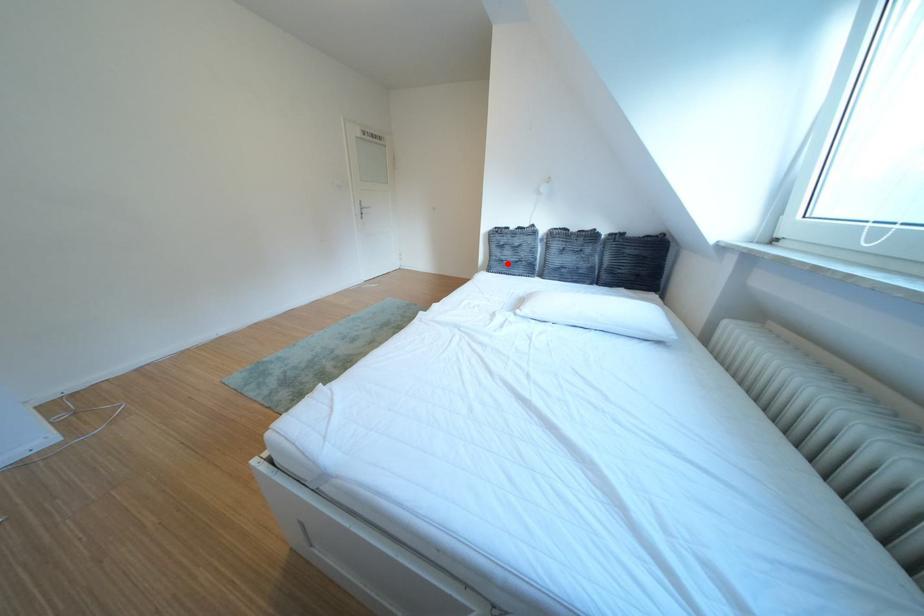
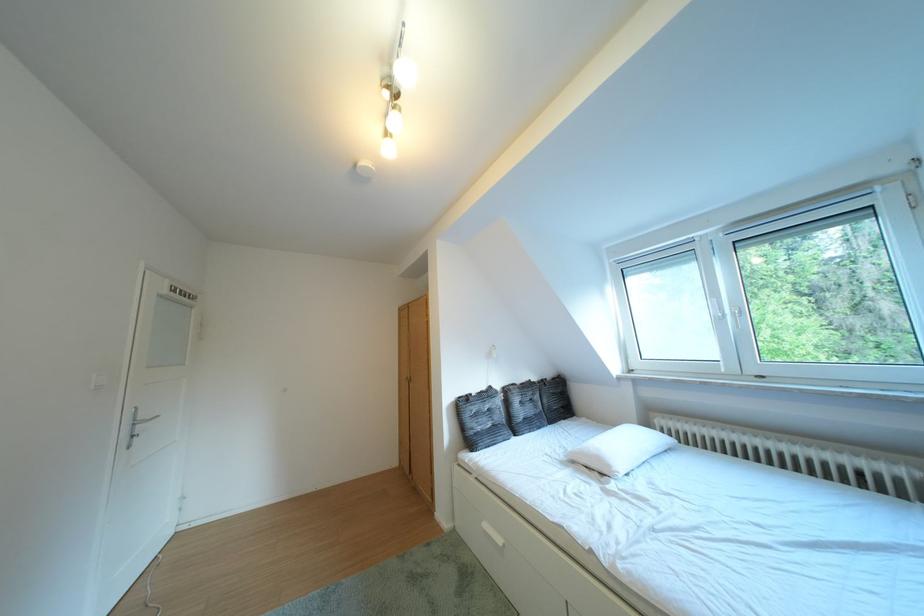
Question: I am providing you with two images of the same scene from different viewpoints. Given a red point in image1, look at the same physical point in image2. Is it:

Choices:
 (A) Closer to the viewpoint
 (B) Farther from the viewpoint

Answer: (B)